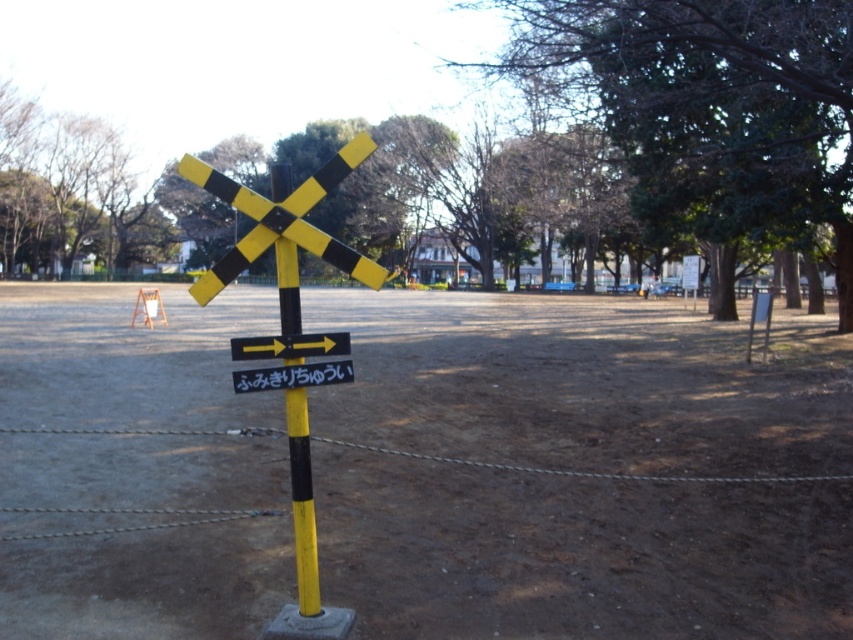
Question: Does green leafy tree at upper center appear over yellow matte pole at center?

Choices:
 (A) no
 (B) yes

Answer: (B)

Question: Estimate the real-world distances between objects in this image. Which object is farther from the brown dirt field at center?

Choices:
 (A) yellow/black plastic sign at center
 (B) yellow/black striped sign at center
 (C) yellow plastic arrow at center
 (D) green leafy tree at upper center

Answer: (C)

Question: Which of the following is the closest to the observer?

Choices:
 (A) (274, 182)
 (B) (846, 218)

Answer: (A)

Question: Which object appears farthest from the camera in this image?

Choices:
 (A) yellow/black plastic sign at center
 (B) brown dirt field at center
 (C) yellow/black striped sign at center
 (D) yellow plastic arrow at center

Answer: (B)

Question: Can you confirm if yellow/black plastic sign at center is positioned to the right of yellow plastic arrow at center?

Choices:
 (A) yes
 (B) no

Answer: (A)

Question: Does yellow/black striped sign at center have a greater width compared to yellow/black plastic sign at center?

Choices:
 (A) no
 (B) yes

Answer: (B)